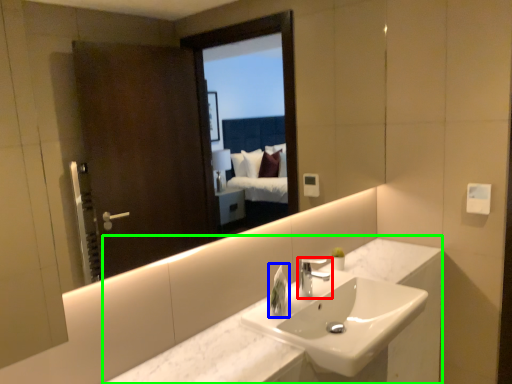
Question: Estimate the real-world distances between objects in this image. Which object is farther from tap (highlighted by a red box), soap dispenser (highlighted by a blue box) or counter (highlighted by a green box)?

Choices:
 (A) soap dispenser
 (B) counter

Answer: (B)